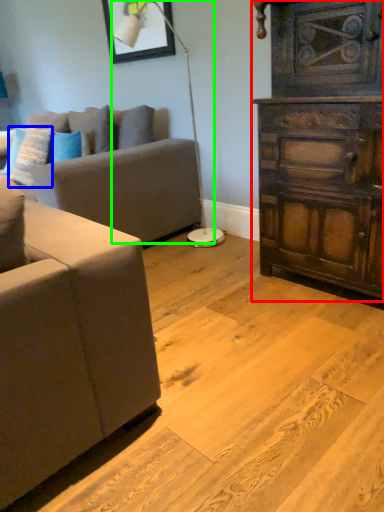
Question: Which object is the closest to the chest of drawers (highlighted by a red box)? Choose among these: pillow (highlighted by a blue box) or lamp (highlighted by a green box).

Choices:
 (A) pillow
 (B) lamp

Answer: (B)